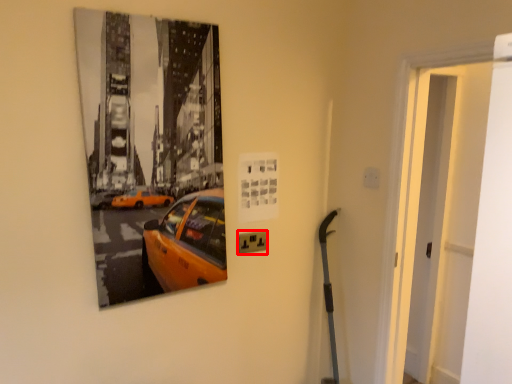
Question: From the image's perspective, considering the relative positions of electric outlet (annotated by the red box) and door in the image provided, where is electric outlet (annotated by the red box) located with respect to the staircase?

Choices:
 (A) below
 (B) above

Answer: (A)